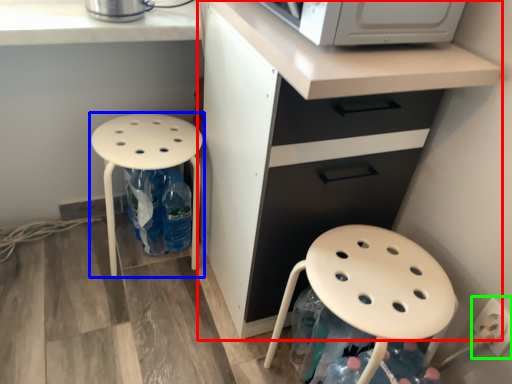
Question: Considering the real-world distances, which object is farthest from cabinetry (highlighted by a red box)? stool (highlighted by a blue box) or electric outlet (highlighted by a green box)?

Choices:
 (A) stool
 (B) electric outlet

Answer: (B)